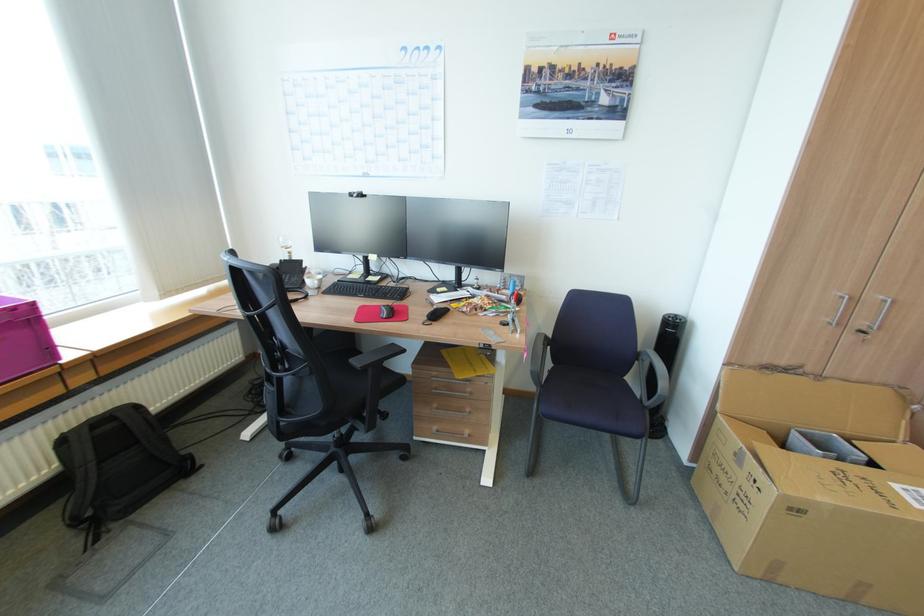
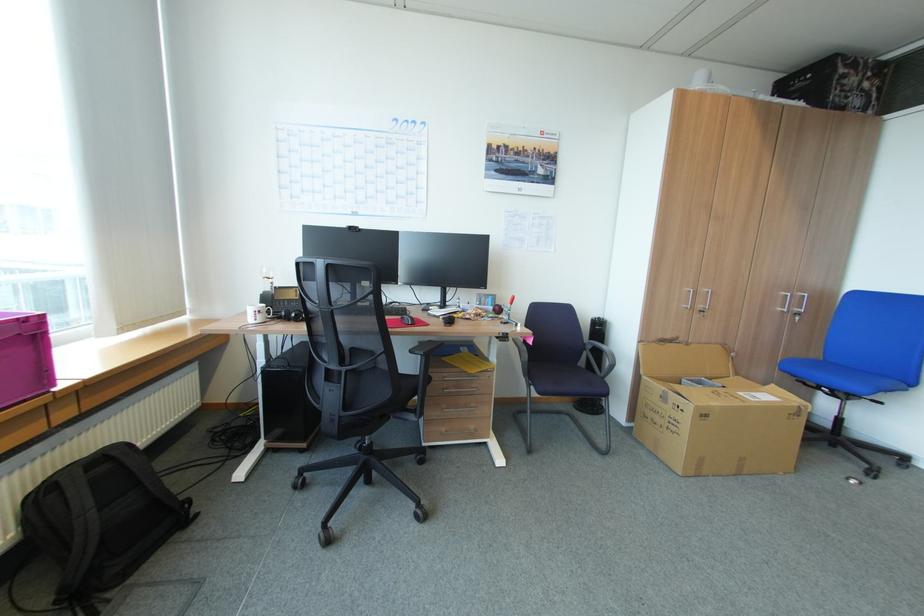
Find the pixel in the second image that matches pixel 846 323 in the first image.

(698, 307)